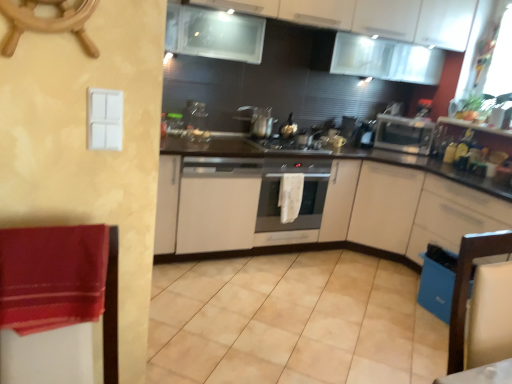
Question: Is wooden chair at lower right with white matte cabinet at center, positioned as the first cabinetry in bottom-to-top order?

Choices:
 (A) yes
 (B) no

Answer: (B)

Question: Can you confirm if wooden chair at lower right is smaller than white matte cabinet at center, acting as the fourth cabinetry starting from the top?

Choices:
 (A) yes
 (B) no

Answer: (A)

Question: Can you confirm if wooden chair at lower right is wider than white matte cabinet at center, positioned as the first cabinetry in bottom-to-top order?

Choices:
 (A) no
 (B) yes

Answer: (A)

Question: Does wooden chair at lower right have a larger size compared to white matte cabinet at center, positioned as the first cabinetry in bottom-to-top order?

Choices:
 (A) yes
 (B) no

Answer: (B)

Question: Does wooden chair at lower right have a lesser height compared to white matte cabinet at center, acting as the fourth cabinetry starting from the top?

Choices:
 (A) yes
 (B) no

Answer: (A)

Question: Is point (423, 304) closer or farther from the camera than point (89, 39)?

Choices:
 (A) closer
 (B) farther

Answer: (B)

Question: Based on their sizes in the image, would you say blue plastic dishwasher at lower right is bigger or smaller than wooden ship's wheel at upper left?

Choices:
 (A) small
 (B) big

Answer: (B)

Question: Is blue plastic dishwasher at lower right to the left or to the right of wooden ship's wheel at upper left in the image?

Choices:
 (A) right
 (B) left

Answer: (A)

Question: In terms of width, does blue plastic dishwasher at lower right look wider or thinner when compared to wooden ship's wheel at upper left?

Choices:
 (A) thin
 (B) wide

Answer: (B)

Question: Is white matte cabinet at center, which ranks as the 3th cabinetry in top-to-bottom order, to the left or to the right of velvet red blanket at left in the image?

Choices:
 (A) right
 (B) left

Answer: (A)

Question: Is white matte cabinet at center, which ranks as the 3th cabinetry in top-to-bottom order, situated inside velvet red blanket at left or outside?

Choices:
 (A) inside
 (B) outside

Answer: (B)

Question: From the image's perspective, is white matte cabinet at center, which ranks as the 3th cabinetry in top-to-bottom order, positioned above or below velvet red blanket at left?

Choices:
 (A) below
 (B) above

Answer: (B)

Question: Is white matte cabinet at center, marked as the 2th cabinetry in a bottom-to-top arrangement, bigger or smaller than velvet red blanket at left?

Choices:
 (A) big
 (B) small

Answer: (A)

Question: In terms of height, does satin silver pot at center look taller or shorter compared to beige tile at center?

Choices:
 (A) tall
 (B) short

Answer: (A)

Question: From a real-world perspective, is satin silver pot at center physically located above or below beige tile at center?

Choices:
 (A) below
 (B) above

Answer: (B)